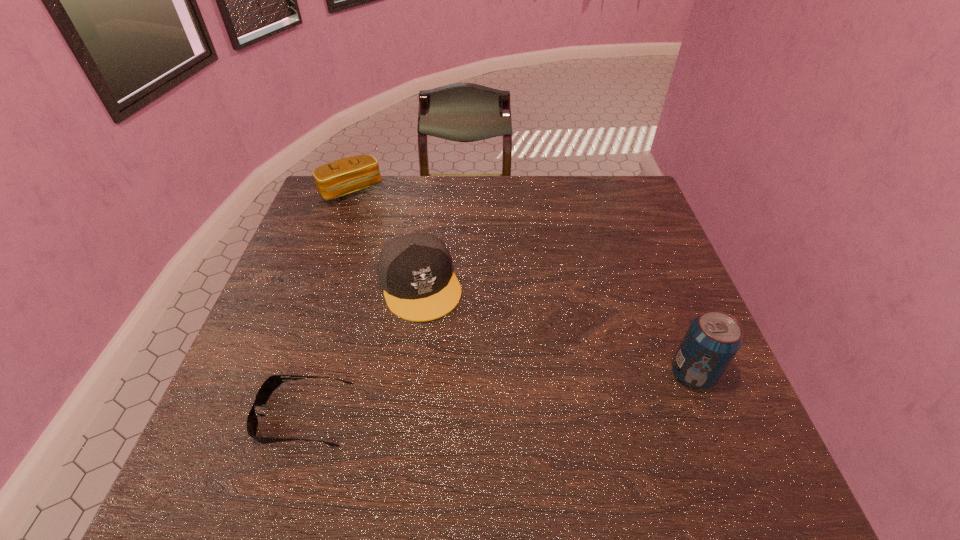
Where is `sunglasses`? sunglasses is located at coordinates (267, 388).

I want to click on the tallest object, so click(x=712, y=340).

This screenshot has height=540, width=960. I want to click on pop soda, so click(712, 340).

This screenshot has width=960, height=540. Find the location of `the third object from left to right`. the third object from left to right is located at coordinates (415, 272).

Where is `cap`? The width and height of the screenshot is (960, 540). cap is located at coordinates (415, 272).

Where is `the farthest object`? the farthest object is located at coordinates (349, 175).

The image size is (960, 540). I want to click on vacant space situated on the left of the rightmost object, so click(498, 374).

This screenshot has height=540, width=960. I want to click on vacant area situated on the front-facing side of the second farthest object, so click(466, 400).

Locate an element on the screen. vacant area situated on the front-facing side of the second farthest object is located at coordinates [453, 369].

This screenshot has width=960, height=540. What are the coordinates of `vacant space located 0.080m on the front-facing side of the second farthest object` in the screenshot? It's located at (443, 345).